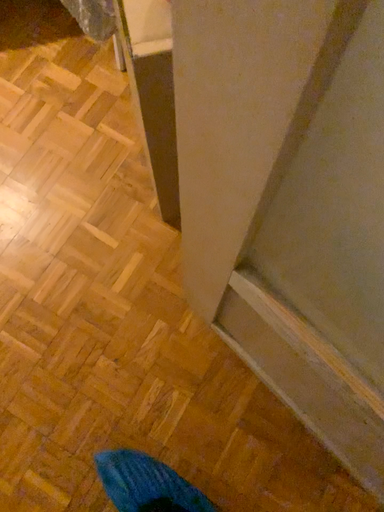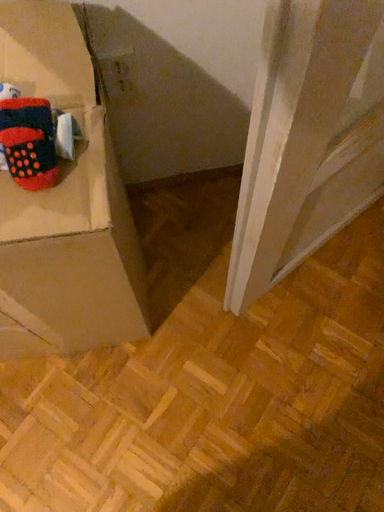
Question: How did the camera likely rotate when shooting the video?

Choices:
 (A) rotated right
 (B) rotated left

Answer: (A)